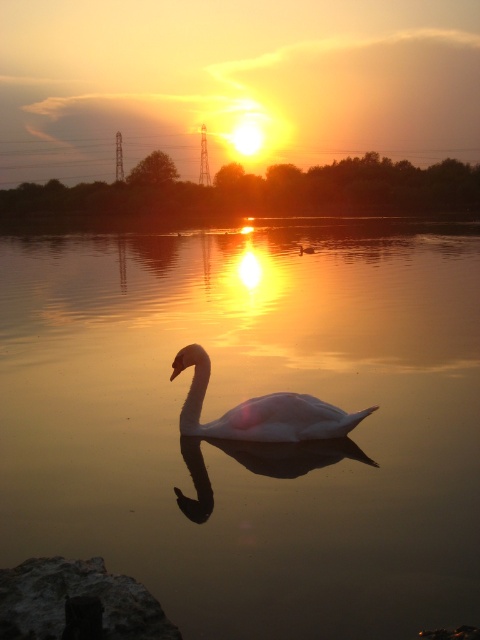
Question: Which point is farther to the camera?

Choices:
 (A) (219, 428)
 (B) (327, 248)
 (C) (7, 632)

Answer: (B)

Question: Is gray rough rock at lower left positioned in front of white glossy swan at center?

Choices:
 (A) no
 (B) yes

Answer: (B)

Question: Does gray rough rock at lower left appear over white glossy swan at center?

Choices:
 (A) yes
 (B) no

Answer: (B)

Question: Considering the real-world distances, which object is closest to the white glossy swan at center?

Choices:
 (A) gray rough rock at lower left
 (B) smooth water at center

Answer: (A)

Question: Which point appears farthest from the camera in this image?

Choices:
 (A) (467, 346)
 (B) (212, 429)

Answer: (A)

Question: Is smooth water at center positioned behind gray rough rock at lower left?

Choices:
 (A) yes
 (B) no

Answer: (A)